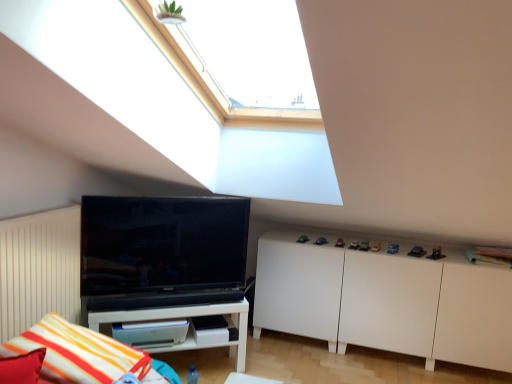
This screenshot has width=512, height=384. Describe the element at coordinates (81, 354) in the screenshot. I see `striped fabric pillow at lower left` at that location.

I want to click on black glossy tv at left, so click(162, 251).

The image size is (512, 384). What do you see at coordinates (189, 327) in the screenshot?
I see `white glossy shelf at lower left` at bounding box center [189, 327].

Where is `white matte cabinet at lower right`? The image size is (512, 384). white matte cabinet at lower right is located at coordinates (385, 302).

Considering their positions, is striped fabric pillow at lower left located in front of or behind white matte cabinet at lower right?

In the image, striped fabric pillow at lower left appears in front of white matte cabinet at lower right.

From the picture: Does striped fabric pillow at lower left appear on the right side of white matte cabinet at lower right?

No, striped fabric pillow at lower left is not to the right of white matte cabinet at lower right.

Locate an element on the screen. This screenshot has height=384, width=512. cabinetry behind the striped fabric pillow at lower left is located at coordinates (385, 302).

From the picture: Is striped fabric pillow at lower left bigger than white matte cabinet at lower right?

No, striped fabric pillow at lower left is not bigger than white matte cabinet at lower right.

Which object is further away from the camera, white glossy shelf at lower left or white matte cabinet at lower right?

white matte cabinet at lower right is behind.

You are a GUI agent. You are given a task and a screenshot of the screen. Output one action in this format:
    pyautogui.click(x=<x>, y=<y>)
    Task: Click on the shelf that appears in front of the white matte cabinet at lower right
    Image resolution: width=512 pixels, height=384 pixels.
    Given the screenshot: What is the action you would take?
    pyautogui.click(x=189, y=327)

Considering the positions of point (94, 323) and point (359, 320), is point (94, 323) closer or farther from the camera than point (359, 320)?

Point (94, 323) is closer to the camera than point (359, 320).

From a real-world perspective, who is located higher, white glossy shelf at lower left or white matte cabinet at lower right?

In real-world perspective, white matte cabinet at lower right is above.

Is white glossy shelf at lower left bigger than black glossy tv at left?

Yes, white glossy shelf at lower left is bigger than black glossy tv at left.

Is white glossy shelf at lower left inside or outside of black glossy tv at left?

The correct answer is: outside.

From the image's perspective, which one is positioned higher, white glossy shelf at lower left or black glossy tv at left?

black glossy tv at left.

From the image's perspective, who appears lower, white matte cabinet at lower right or white glossy shelf at lower left?

white glossy shelf at lower left.

Who is bigger, white matte cabinet at lower right or white glossy shelf at lower left?

With larger size is white matte cabinet at lower right.

Where is `cabinetry on the right of white glossy shelf at lower left`? The image size is (512, 384). cabinetry on the right of white glossy shelf at lower left is located at coordinates (385, 302).

Considering the relative positions of striped fabric pillow at lower left and white glossy shelf at lower left in the image provided, is striped fabric pillow at lower left to the left of white glossy shelf at lower left from the viewer's perspective?

Yes, striped fabric pillow at lower left is to the left of white glossy shelf at lower left.

In the scene shown: Is striped fabric pillow at lower left looking in the opposite direction of white glossy shelf at lower left?

That's not correct — striped fabric pillow at lower left is not looking away from white glossy shelf at lower left.

Based on their sizes in the image, would you say striped fabric pillow at lower left is bigger or smaller than white glossy shelf at lower left?

striped fabric pillow at lower left is bigger than white glossy shelf at lower left.

Which is in front, point (92, 347) or point (179, 348)?

The point (92, 347) is in front.

In the scene shown: Considering the sizes of objects black glossy tv at left and white glossy shelf at lower left in the image provided, who is wider, black glossy tv at left or white glossy shelf at lower left?

white glossy shelf at lower left.

Measure the distance between black glossy tv at left and white glossy shelf at lower left.

black glossy tv at left is 11.03 inches away from white glossy shelf at lower left.

Which of these two, black glossy tv at left or white glossy shelf at lower left, is smaller?

black glossy tv at left.

Is black glossy tv at left in front of white glossy shelf at lower left?

Yes, the depth of black glossy tv at left is less than that of white glossy shelf at lower left.

At what (x,y) coordinates should I click in order to perform the action: click on television on the right side of striped fabric pillow at lower left. Please return your answer as a coordinate pair (x, y). Looking at the image, I should click on (162, 251).

Is black glossy tv at left shorter than striped fabric pillow at lower left?

In fact, black glossy tv at left may be taller than striped fabric pillow at lower left.

From the image's perspective, relative to striped fabric pillow at lower left, is black glossy tv at left above or below?

From the image's perspective, black glossy tv at left appears above striped fabric pillow at lower left.

This screenshot has height=384, width=512. What are the coordinates of `pillow on the left of white matte cabinet at lower right` in the screenshot? It's located at (81, 354).

Locate an element on the screen. cabinetry behind the white glossy shelf at lower left is located at coordinates (385, 302).

When comparing their distances from striped fabric pillow at lower left, does white matte cabinet at lower right or white glossy shelf at lower left seem further?

white matte cabinet at lower right lies further to striped fabric pillow at lower left than the other object.

Considering their positions, is white matte cabinet at lower right positioned further to white glossy shelf at lower left than striped fabric pillow at lower left?

white matte cabinet at lower right is positioned further to the anchor white glossy shelf at lower left.

Estimate the real-world distances between objects in this image. Which object is closer to black glossy tv at left, white matte cabinet at lower right or white glossy shelf at lower left?

white glossy shelf at lower left.

Estimate the real-world distances between objects in this image. Which object is further from white matte cabinet at lower right, white glossy shelf at lower left or black glossy tv at left?

black glossy tv at left is positioned further to the anchor white matte cabinet at lower right.

Looking at the image, which one is located closer to white glossy shelf at lower left, black glossy tv at left or striped fabric pillow at lower left?

Based on the image, black glossy tv at left appears to be nearer to white glossy shelf at lower left.

Based on their spatial positions, is black glossy tv at left or striped fabric pillow at lower left further from white matte cabinet at lower right?

striped fabric pillow at lower left lies further to white matte cabinet at lower right than the other object.

Which object lies further to the anchor point striped fabric pillow at lower left, white glossy shelf at lower left or black glossy tv at left?

black glossy tv at left is positioned further to the anchor striped fabric pillow at lower left.

Considering their positions, is white matte cabinet at lower right positioned closer to black glossy tv at left than striped fabric pillow at lower left?

The object closer to black glossy tv at left is striped fabric pillow at lower left.

Identify the location of television located between striped fabric pillow at lower left and white matte cabinet at lower right in the left-right direction. The height and width of the screenshot is (384, 512). (162, 251).

Locate an element on the screen. The width and height of the screenshot is (512, 384). television between striped fabric pillow at lower left and white glossy shelf at lower left along the z-axis is located at coordinates (162, 251).

The image size is (512, 384). In order to click on television located between white glossy shelf at lower left and white matte cabinet at lower right in the left-right direction in this screenshot , I will do `click(162, 251)`.

You are a GUI agent. You are given a task and a screenshot of the screen. Output one action in this format:
    pyautogui.click(x=<x>, y=<y>)
    Task: Click on the shelf situated between striped fabric pillow at lower left and white matte cabinet at lower right from left to right
    
    Given the screenshot: What is the action you would take?
    pyautogui.click(x=189, y=327)